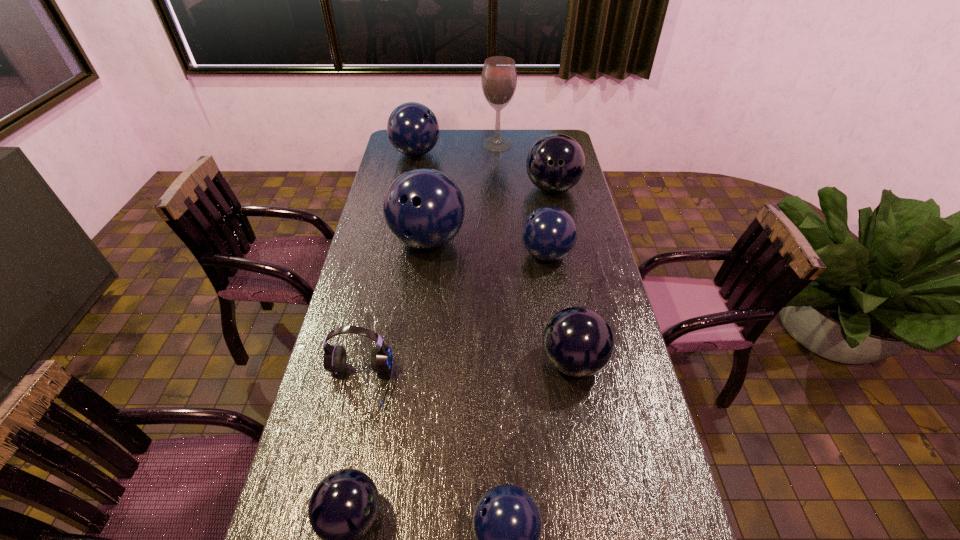
You are a GUI agent. You are given a task and a screenshot of the screen. Output one action in this format:
    pyautogui.click(x=<x>, y=<y>)
    Task: Click on the alcohol
    Image resolution: width=960 pixels, height=540 pixels.
    Given the screenshot: What is the action you would take?
    pyautogui.click(x=499, y=77)

The width and height of the screenshot is (960, 540). I want to click on red alcohol, so click(x=499, y=77).

Locate an element on the screen. The image size is (960, 540). the biggest blue bowling ball is located at coordinates [423, 208].

Where is `the tallest bowling ball`? the tallest bowling ball is located at coordinates (423, 208).

Image resolution: width=960 pixels, height=540 pixels. Identify the location of the farthest blue bowling ball. (413, 129).

Locate an element on the screen. the farthest bowling ball is located at coordinates (413, 129).

The width and height of the screenshot is (960, 540). What are the coordinates of `the farthest black bowling ball` in the screenshot? It's located at (555, 163).

Where is `the sixth nearest bowling ball`? The height and width of the screenshot is (540, 960). the sixth nearest bowling ball is located at coordinates (555, 163).

What are the coordinates of `the third biggest blue bowling ball` in the screenshot? It's located at click(549, 233).

Where is `the fifth farthest bowling ball`? The image size is (960, 540). the fifth farthest bowling ball is located at coordinates (578, 341).